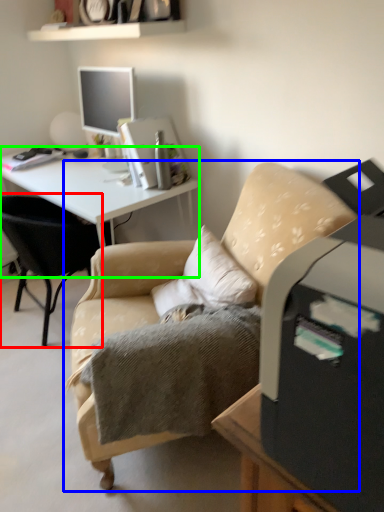
Question: Estimate the real-world distances between objects in this image. Which object is farther from chair (highlighted by a red box), chair (highlighted by a blue box) or desk (highlighted by a green box)?

Choices:
 (A) chair
 (B) desk

Answer: (A)